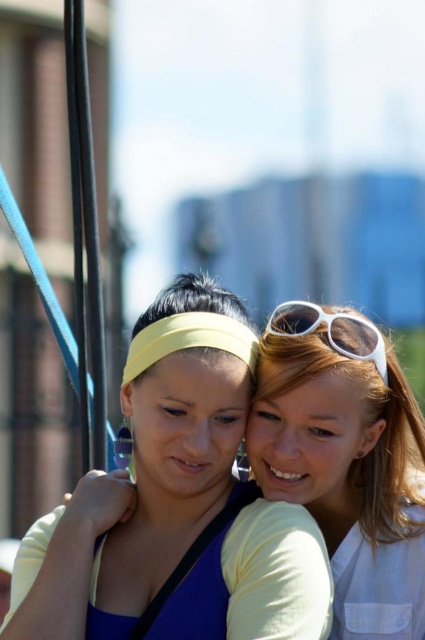
Question: Is matte yellow headband at center positioned at the back of white matte sunglasses at upper right?

Choices:
 (A) yes
 (B) no

Answer: (B)

Question: Which point is closer to the camera taking this photo?

Choices:
 (A) (411, 401)
 (B) (357, 332)
 (C) (289, 552)

Answer: (C)

Question: Which point appears farthest from the camera in this image?

Choices:
 (A) (379, 364)
 (B) (317, 376)
 (C) (175, 432)

Answer: (A)

Question: Can you confirm if matte yellow headband at center is wider than white plastic sunglasses at upper right?

Choices:
 (A) yes
 (B) no

Answer: (A)

Question: Which point is farther to the camera?

Choices:
 (A) white matte sunglasses at upper right
 (B) matte yellow headband at center

Answer: (A)

Question: Is white matte sunglasses at upper right wider than white plastic sunglasses at upper right?

Choices:
 (A) no
 (B) yes

Answer: (B)